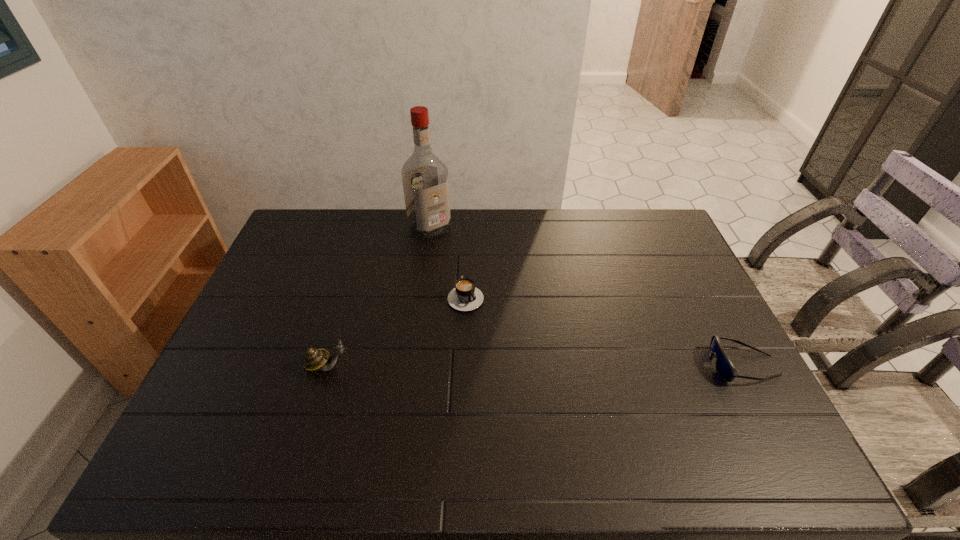
Identify the location of snail. (315, 359).

Find the location of `the leftmost object`. the leftmost object is located at coordinates (315, 359).

Find the location of `sunglasses`. sunglasses is located at coordinates (724, 367).

Find the location of a particular element. The width and height of the screenshot is (960, 540). the second farthest object is located at coordinates (465, 296).

The image size is (960, 540). Find the location of `cappuccino`. cappuccino is located at coordinates (465, 296).

Locate an element on the screen. This screenshot has width=960, height=540. the tallest object is located at coordinates coord(425,179).

Find the location of `liquor`. liquor is located at coordinates (425, 179).

This screenshot has width=960, height=540. Identify the location of vacant space located 0.110m on the face of the snail. (394, 366).

The height and width of the screenshot is (540, 960). In order to click on vacant region located on the front-facing side of the sunglasses in this screenshot , I will do `click(593, 365)`.

I want to click on vacant space located 0.350m on the front-facing side of the sunglasses, so (x=579, y=365).